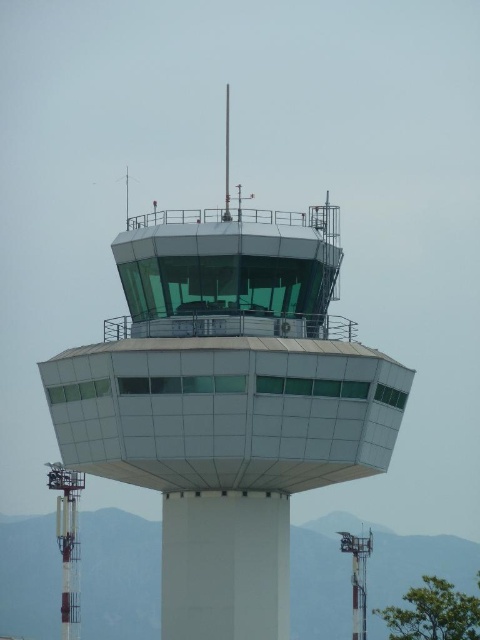
Question: Is white glass tower at center to the left of white glossy control tower at left from the viewer's perspective?

Choices:
 (A) yes
 (B) no

Answer: (B)

Question: Which point is closer to the camera taking this photo?

Choices:
 (A) (64, 484)
 (B) (68, 352)
 (C) (363, 637)

Answer: (B)

Question: Which object is the farthest from the metallic antenna at lower right?

Choices:
 (A) white glossy control tower at left
 (B) white glass tower at center

Answer: (B)

Question: Which of the following is the farthest from the observer?

Choices:
 (A) (x=127, y=396)
 (B) (x=365, y=584)

Answer: (B)

Question: Does white glass tower at center appear under metallic antenna at lower right?

Choices:
 (A) no
 (B) yes

Answer: (A)

Question: Can you confirm if white glass tower at center is thinner than white glossy control tower at left?

Choices:
 (A) yes
 (B) no

Answer: (B)